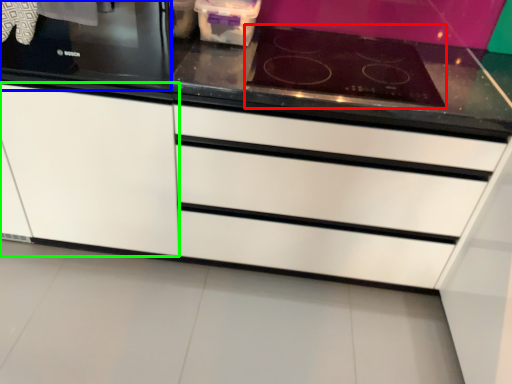
Question: Which object is the closest to the gas stove (highlighted by a red box)? Choose among these: home appliance (highlighted by a blue box) or cabinetry (highlighted by a green box).

Choices:
 (A) home appliance
 (B) cabinetry

Answer: (A)